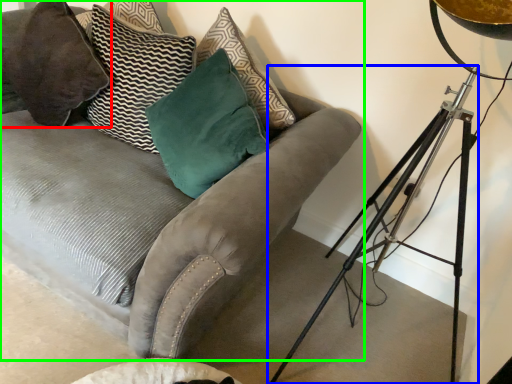
Question: Which object is the closest to the pillow (highlighted by a red box)? Choose among these: tripod (highlighted by a blue box) or studio couch (highlighted by a green box).

Choices:
 (A) tripod
 (B) studio couch

Answer: (B)